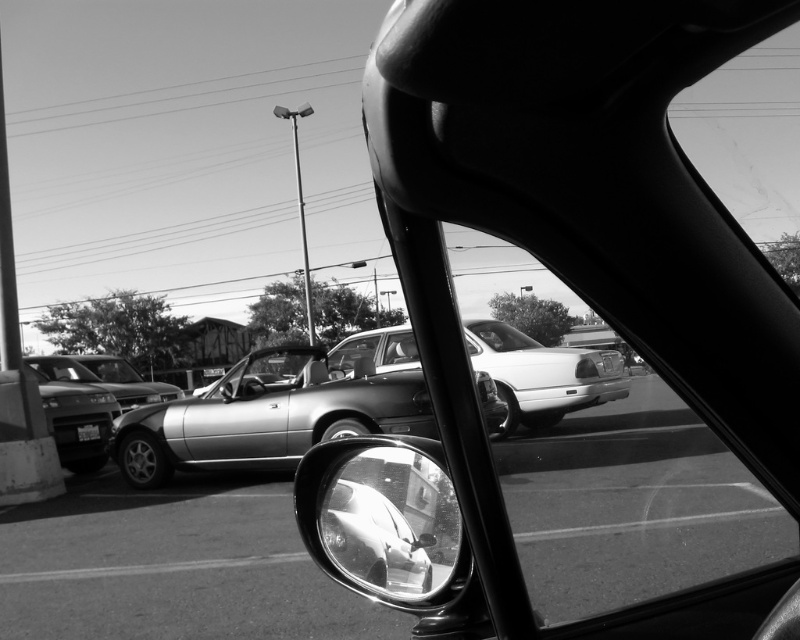
You are a driver trying to park your car in the parking lot shown in the image. You see a shiny silver sedan at left and a shiny silver convertible at center. Which car takes up more space in the parking spot?

The shiny silver convertible at center occupies more space than the shiny silver sedan at left.

You are a driver looking at the parking lot through the windshield. There are two shiny silver cars in front of you, a shiny silver sedan at left and a shiny silver convertible at center. Which one is more to the left?

The shiny silver convertible at center is more to the left because the shiny silver sedan at left is positioned on the right side of it.

You are a driver looking through the windshield of your car. You notice a shiny metallic convertible at center. Where exactly is the shiny metallic convertible located in relation to the point marked as point (268, 416)?

The shiny metallic convertible at center is located exactly at point (268, 416).